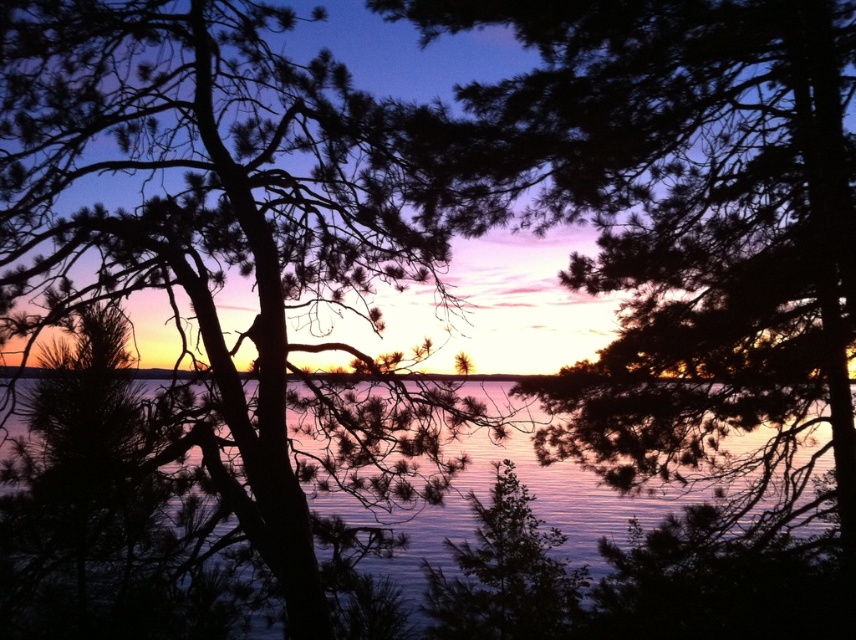
You are a photographer standing at the edge of the water. You want to capture a photo of the silhouette tree at center and the blue reflective water at center. If your camera can focus on objects within 5 meters, will both objects be in focus?

The distance between the silhouette tree at center and blue reflective water at center is 5.68 meters. Since your camera can only focus within 5 meters, the two objects are too far apart for both to be in focus simultaneously.

You are a photographer aiming to capture the reflection of the sunset in the water. You notice the silky dark green branches at center and the blue reflective water at center. Which object is closer to the camera, and why?

The silky dark green branches at center are closer to the camera because they appear shorter than the blue reflective water at center, indicating they are positioned in the foreground.

You are an artist trying to paint the sunset scene. You have to decide which object to paint first between the silhouette tree at center and the blue reflective water at center. Based on their sizes, which one should you paint first to ensure proper scaling?

The silhouette tree at center is smaller compared to the blue reflective water at center. Therefore, you should paint the blue reflective water at center first as it is larger and forms the base, allowing you to scale the smaller silhouette tree at center appropriately on top.